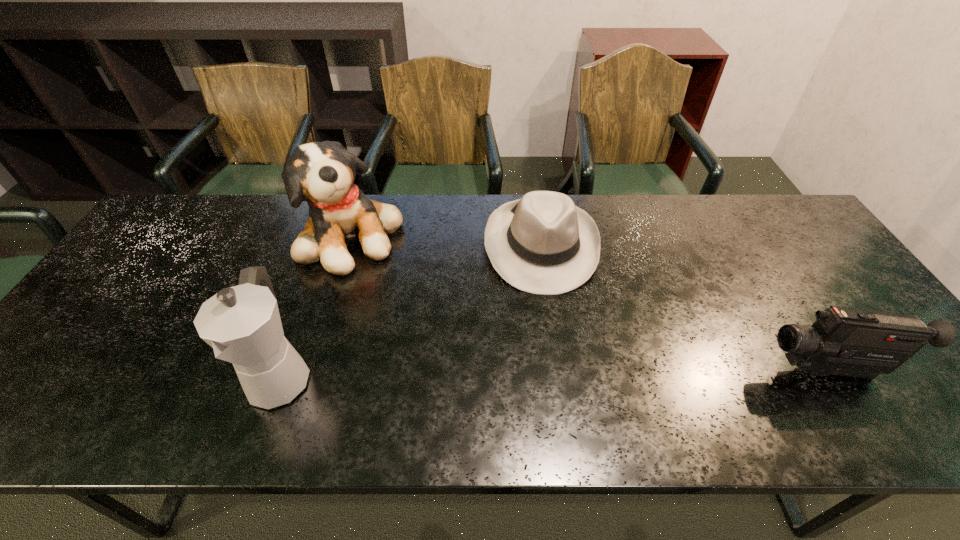
What are the coordinates of `free area in between the second shortest object and the puppy` in the screenshot? It's located at (589, 304).

What are the coordinates of `free space between the puppy and the coffeepot` in the screenshot? It's located at (316, 307).

What are the coordinates of `vacant point located between the puppy and the coffeepot` in the screenshot? It's located at (316, 307).

Locate an element on the screen. This screenshot has width=960, height=540. free spot between the third tallest object and the shortest object is located at coordinates (684, 308).

The width and height of the screenshot is (960, 540). I want to click on vacant region between the rightmost object and the fedora, so click(684, 308).

The height and width of the screenshot is (540, 960). I want to click on free space between the shortest object and the second shortest object, so click(684, 308).

I want to click on vacant region between the camcorder and the puppy, so click(589, 304).

At what (x,y) coordinates should I click in order to perform the action: click on vacant area between the coffeepot and the shortest object. Please return your answer as a coordinate pair (x, y). The height and width of the screenshot is (540, 960). Looking at the image, I should click on (411, 311).

At what (x,y) coordinates should I click in order to perform the action: click on object that is the third closest one to the puppy. Please return your answer as a coordinate pair (x, y). This screenshot has width=960, height=540. Looking at the image, I should click on point(851,342).

Choose which object is the second nearest neighbor to the camcorder. Please provide its 2D coordinates. Your answer should be formatted as a tuple, i.e. [(x, y)], where the tuple contains the x and y coordinates of a point satisfying the conditions above.

[(322, 173)]